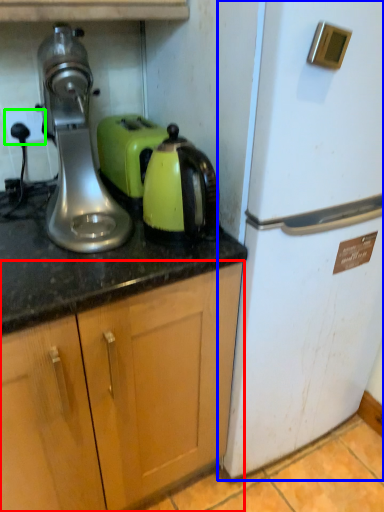
Question: Which is farther away from cabinetry (highlighted by a red box)? refrigerator (highlighted by a blue box) or electric outlet (highlighted by a green box)?

Choices:
 (A) refrigerator
 (B) electric outlet

Answer: (B)